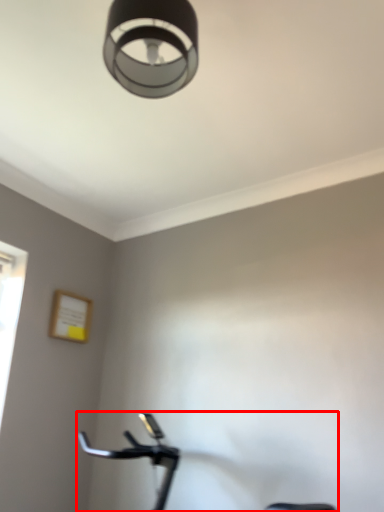
Question: From the image's perspective, where is stationary bicycle (annotated by the red box) located in relation to lamp in the image?

Choices:
 (A) below
 (B) above

Answer: (A)